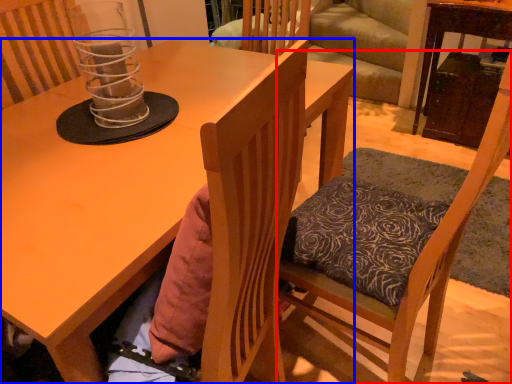
Question: Which point is closer to the camera, chair (highlighted by a red box) or desk (highlighted by a blue box)?

Choices:
 (A) chair
 (B) desk

Answer: (A)